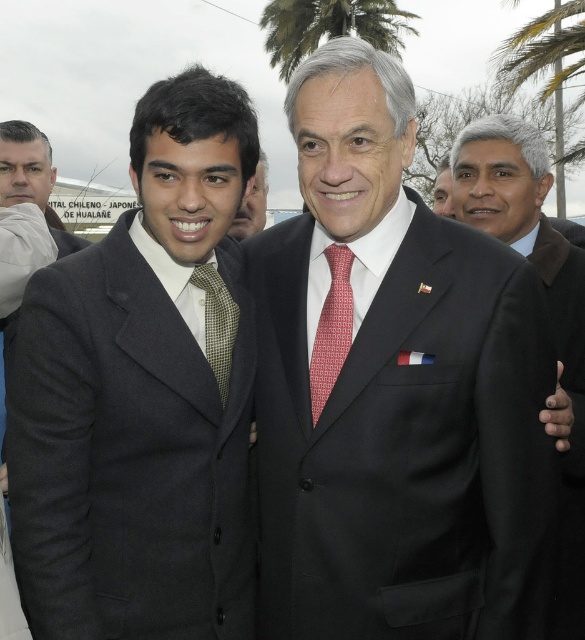
Question: Which point is farther to the camera?

Choices:
 (A) (574, 634)
 (B) (566, 520)
 (C) (563, 148)
 (D) (218, 380)

Answer: (C)

Question: Is matte green tie at center positioned at the back of matte black suit at center?

Choices:
 (A) yes
 (B) no

Answer: (B)

Question: Which object is the closest to the matte black suit at left?

Choices:
 (A) green leafy palm tree at upper right
 (B) dark gray suit at center
 (C) green checkered tie at center
 (D) green leafy palm tree at upper center

Answer: (C)

Question: Which of these objects is positioned farthest from the black matte suit at center?

Choices:
 (A) matte black suit at left
 (B) green leafy palm tree at upper right
 (C) green checkered tie at center
 (D) matte green tie at center

Answer: (B)

Question: Is green leafy palm tree at upper center closer to camera compared to matte green tie at center?

Choices:
 (A) no
 (B) yes

Answer: (A)

Question: Is dark gray suit at center positioned in front of green leafy palm tree at upper center?

Choices:
 (A) yes
 (B) no

Answer: (A)